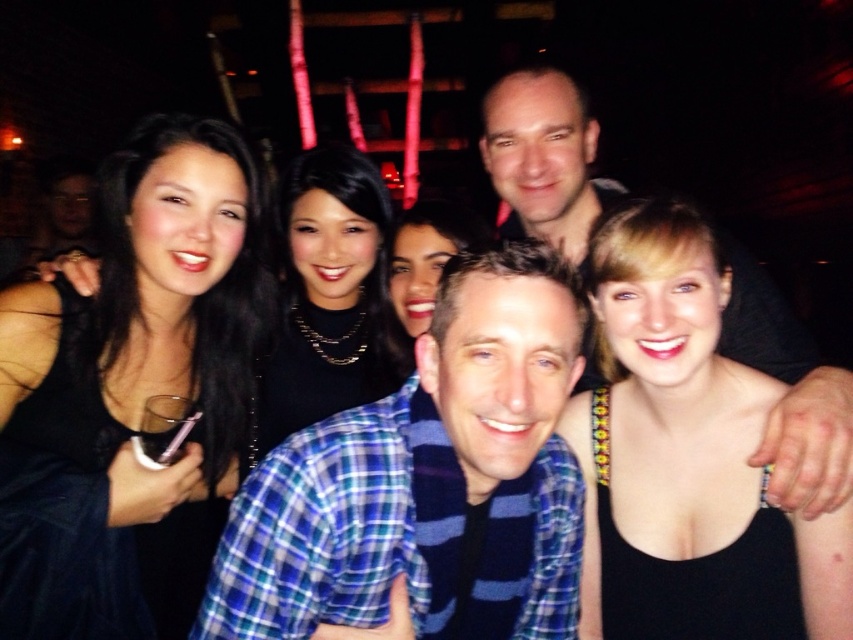
You are a photographer at the event and need to adjust the lighting to highlight both the black matte necklace at center and the matte black dress at center. Since the necklace is smaller, you decide to use a spotlight. However, the dress is larger. Which object requires a wider spotlight to properly illuminate it?

The matte black dress at center requires a wider spotlight because it has a larger size compared to the black matte necklace at center.

You are a photographer trying to focus on the black matte necklace at center and the matte black shirt at upper center. Which object should you adjust your camera focus on first to ensure both are in focus?

The black matte necklace at center should be focused on first since it is closer to the viewer than the matte black shirt at upper center, allowing the camera to adjust focus from near to far for both objects.

You are a photographer trying to capture a group photo of the matte black shirt at upper center and the matte black dress at center. Which subject should you position closer to the camera to ensure both appear equally wide in the photo?

You should position the matte black dress at center closer to the camera because the matte black shirt at upper center might be wider than the matte black dress at center, so moving the dress forward will help balance their apparent widths.